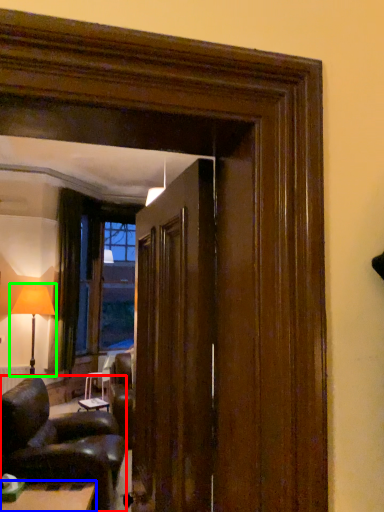
Question: Considering the real-world distances, which object is closest to chair (highlighted by a red box)? table (highlighted by a blue box) or table lamp (highlighted by a green box).

Choices:
 (A) table
 (B) table lamp

Answer: (A)